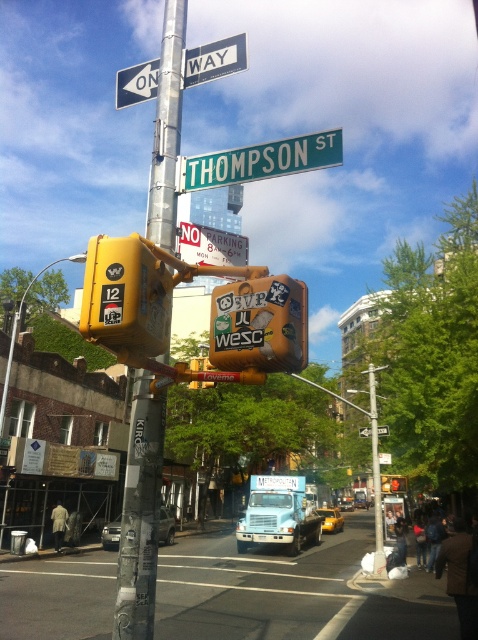
Question: Considering the real-world distances, which object is closest to the green metallic street sign at upper center?

Choices:
 (A) white paper sign at upper center
 (B) blue metallic truck at center

Answer: (A)

Question: Can you confirm if orange fabric traffic light at center is positioned above green metallic street sign at upper center?

Choices:
 (A) yes
 (B) no

Answer: (B)

Question: Which object is farther from the camera taking this photo?

Choices:
 (A) metallic pole at center
 (B) green metallic street sign at upper center
 (C) yellow plastic traffic light at center
 (D) orange fabric traffic light at center

Answer: (C)

Question: Which of these objects is positioned closest to the blue metallic truck at center?

Choices:
 (A) orange fabric traffic light at center
 (B) metallic pole at upper center

Answer: (B)

Question: Does yellow matte traffic light at upper left appear under orange fabric traffic light at center?

Choices:
 (A) yes
 (B) no

Answer: (B)

Question: Does metallic pole at upper center appear on the right side of green metallic street sign at upper center?

Choices:
 (A) yes
 (B) no

Answer: (B)